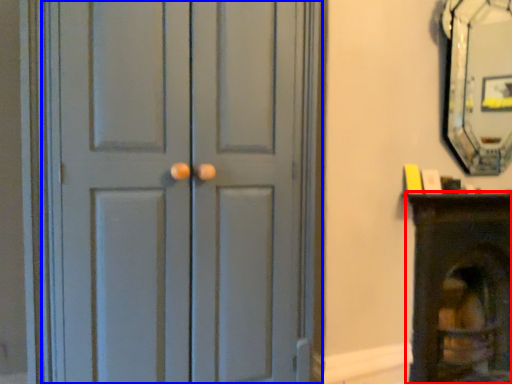
Question: Which of the following is the closest to the observer, furniture (highlighted by a red box) or door (highlighted by a blue box)?

Choices:
 (A) furniture
 (B) door

Answer: (B)